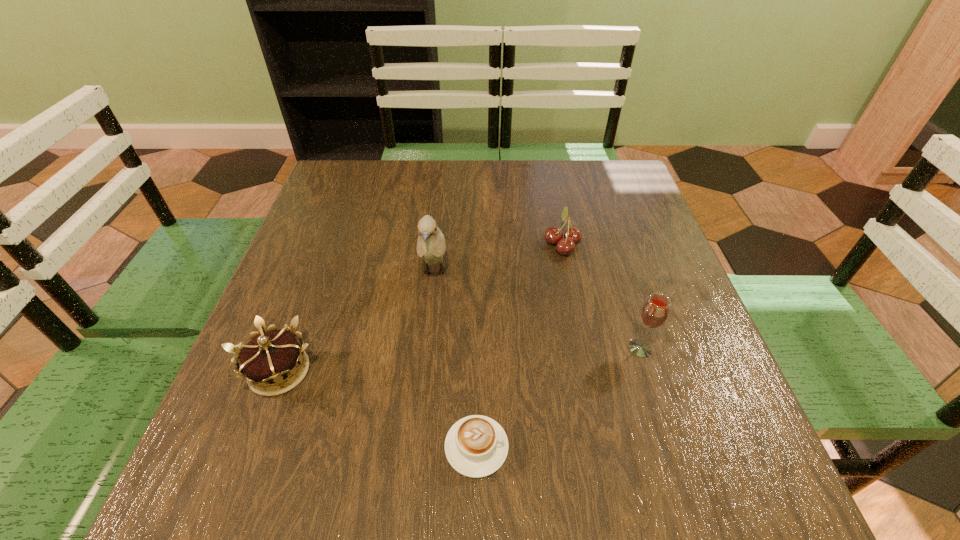
The image size is (960, 540). Find the location of `free space located on the right of the crown`. free space located on the right of the crown is located at coordinates 425,371.

The image size is (960, 540). In order to click on free space located 0.290m on the leaves of the cherry in this screenshot , I will do `click(422, 244)`.

This screenshot has width=960, height=540. Identify the location of blank area located 0.330m on the leaves of the cherry. (405, 244).

The height and width of the screenshot is (540, 960). In order to click on free spot located 0.120m on the leaves of the cherry in this screenshot , I will do `click(493, 244)`.

At what (x,y) coordinates should I click in order to perform the action: click on free space located with the handle on the right side of the nearest object. Please return your answer as a coordinate pair (x, y). This screenshot has width=960, height=540. Looking at the image, I should click on (589, 447).

Find the location of `object located at the near edge`. object located at the near edge is located at coordinates (476, 446).

This screenshot has height=540, width=960. Find the location of `object at the left edge`. object at the left edge is located at coordinates (273, 362).

The height and width of the screenshot is (540, 960). I want to click on object situated at the right edge, so click(x=655, y=311).

Image resolution: width=960 pixels, height=540 pixels. Identify the location of free location at the far edge. (479, 168).

In the image, there is a desktop. What are the coordinates of `vacant space at the near edge` in the screenshot? It's located at (311, 492).